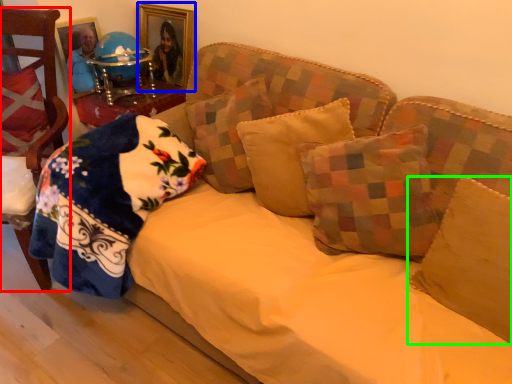
Question: Considering the real-world distances, which object is closest to chair (highlighted by a red box)? picture frame (highlighted by a blue box) or pillow (highlighted by a green box).

Choices:
 (A) picture frame
 (B) pillow

Answer: (A)